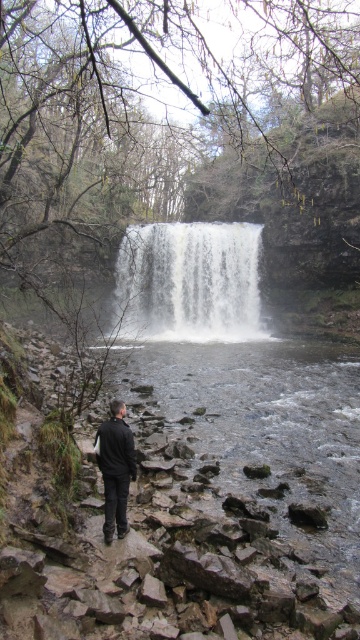
Is white textured water at center shorter than black matte jacket at center?

No, white textured water at center is not shorter than black matte jacket at center.

Can you confirm if white textured water at center is positioned to the right of black matte jacket at center?

Yes, white textured water at center is to the right of black matte jacket at center.

Is point (122, 282) behind point (129, 464)?

Yes, point (122, 282) is behind point (129, 464).

Where is `white textured water at center`? This screenshot has height=640, width=360. white textured water at center is located at coordinates (190, 282).